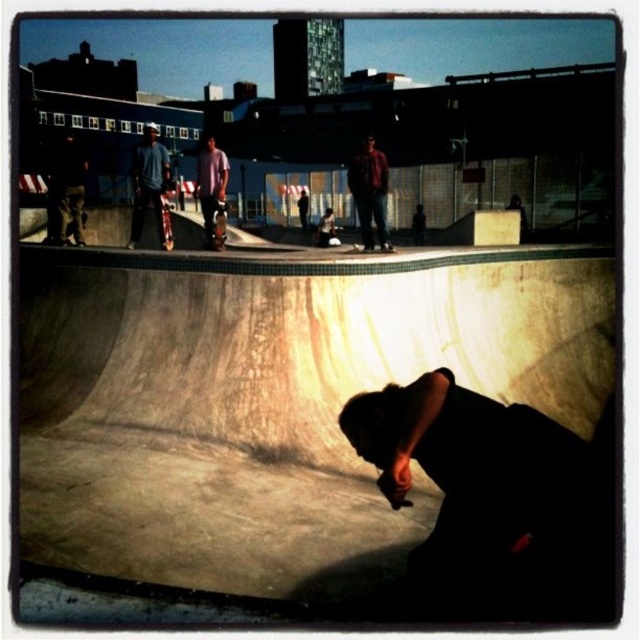
Question: Which point is closer to the camera?

Choices:
 (A) smooth black skateboard at center
 (B) maroon shirt at center

Answer: (B)

Question: Estimate the real-world distances between objects in this image. Which object is farther from the wooden skateboard at center?

Choices:
 (A) smooth black skateboard at center
 (B) smooth concrete bowl at center

Answer: (B)

Question: Does smooth concrete bowl at center lie behind dark matte clothing at lower center?

Choices:
 (A) no
 (B) yes

Answer: (A)

Question: Can you confirm if smooth concrete bowl at center is smaller than dark matte clothing at lower center?

Choices:
 (A) no
 (B) yes

Answer: (A)

Question: Which of the following is the farthest from the observer?

Choices:
 (A) dark matte clothing at lower center
 (B) smooth concrete bowl at center
 (C) smooth black skateboard at center

Answer: (C)

Question: Can you confirm if dark matte clothing at lower center is positioned below blue denim jeans at upper left?

Choices:
 (A) yes
 (B) no

Answer: (A)